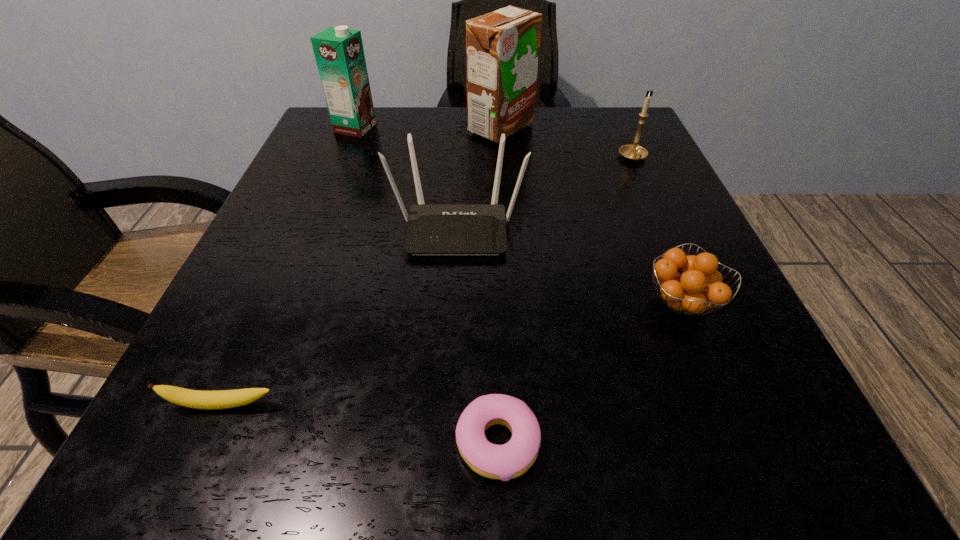
You are a GUI agent. You are given a task and a screenshot of the screen. Output one action in this format:
    pyautogui.click(x=<x>, y=<y>)
    Task: Click on the carton located in the left edge section of the desktop
    Image resolution: width=960 pixels, height=540 pixels.
    Given the screenshot: What is the action you would take?
    pyautogui.click(x=339, y=53)

Locate an element on the screen. The height and width of the screenshot is (540, 960). banana located in the left edge section of the desktop is located at coordinates (209, 400).

You are a GUI agent. You are given a task and a screenshot of the screen. Output one action in this format:
    pyautogui.click(x=<x>, y=<y>)
    Task: Click on the candle holder that is at the right edge
    
    Given the screenshot: What is the action you would take?
    pyautogui.click(x=633, y=152)

This screenshot has height=540, width=960. I want to click on orange fruit that is positioned at the right edge, so click(699, 288).

The height and width of the screenshot is (540, 960). Find the location of `object that is positioned at the far left corner`. object that is positioned at the far left corner is located at coordinates (339, 53).

You are a GUI agent. You are given a task and a screenshot of the screen. Output one action in this format:
    pyautogui.click(x=<x>, y=<y>)
    Task: Click on the object that is at the near left corner
    The height and width of the screenshot is (540, 960).
    Given the screenshot: What is the action you would take?
    pyautogui.click(x=209, y=400)

You are a GUI agent. You are given a task and a screenshot of the screen. Output one action in this format:
    pyautogui.click(x=<x>, y=<y>)
    Task: Click on the object located at the far right corner
    The width and height of the screenshot is (960, 540).
    Given the screenshot: What is the action you would take?
    pyautogui.click(x=633, y=152)

Locate an element on the screen. This screenshot has width=960, height=540. free point at the far edge is located at coordinates (425, 134).

What are the coordinates of `vacant space at the near edge` in the screenshot? It's located at (428, 415).

Where is `vacant space at the left edge of the desktop`? vacant space at the left edge of the desktop is located at coordinates (298, 188).